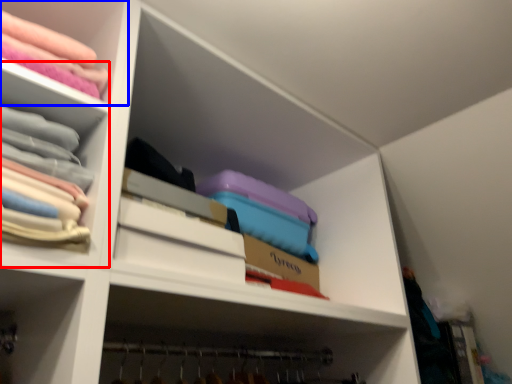
Question: Which object is closer to the camera taking this photo, cabinet (highlighted by a red box) or shelf (highlighted by a blue box)?

Choices:
 (A) cabinet
 (B) shelf

Answer: (A)